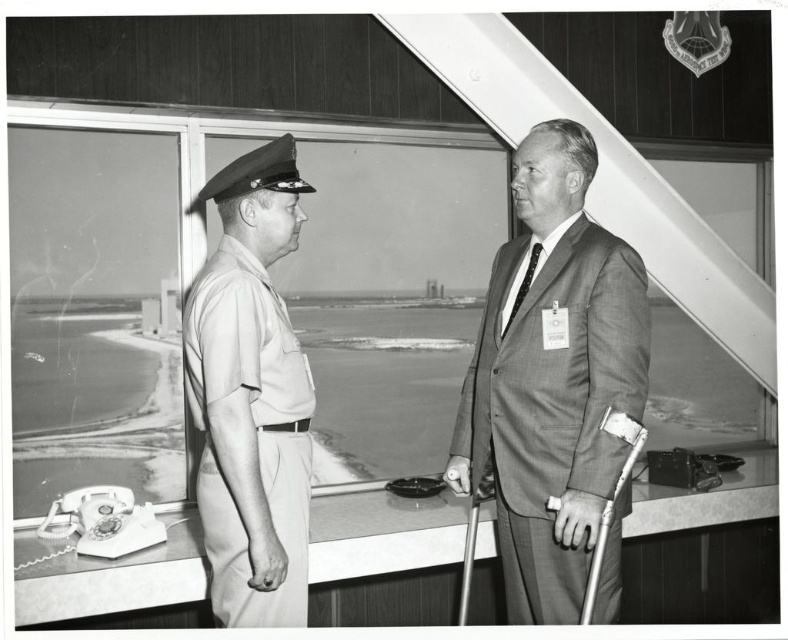
Question: Where is gray suit at center located in relation to khaki uniform at left in the image?

Choices:
 (A) below
 (B) above

Answer: (A)

Question: Is gray suit at center bigger than khaki uniform at left?

Choices:
 (A) yes
 (B) no

Answer: (A)

Question: Which of the following is the farthest from the observer?

Choices:
 (A) gray suit at center
 (B) khaki uniform at left

Answer: (A)

Question: Which object appears closest to the camera in this image?

Choices:
 (A) khaki uniform at left
 (B) gray suit at center

Answer: (A)

Question: Is gray suit at center above khaki uniform at left?

Choices:
 (A) no
 (B) yes

Answer: (A)

Question: Which point appears farthest from the camera in this image?

Choices:
 (A) (272, 330)
 (B) (541, 496)

Answer: (B)